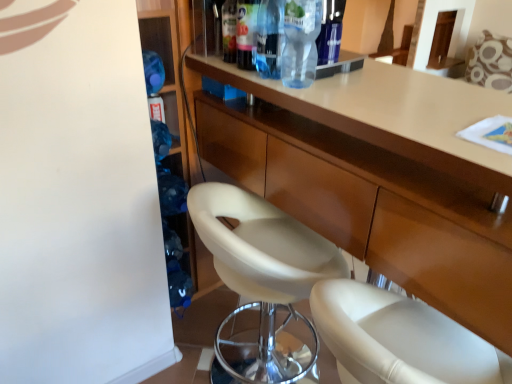
Question: Considering the positions of matte wood cabinet at center and transparent plastic bottle at upper center, which ranks as the 2th bottle in left-to-right order, in the image, is matte wood cabinet at center wider or thinner than transparent plastic bottle at upper center, which ranks as the 2th bottle in left-to-right order,?

Choices:
 (A) wide
 (B) thin

Answer: (A)

Question: Is point (409, 173) positioned closer to the camera than point (256, 59)?

Choices:
 (A) farther
 (B) closer

Answer: (B)

Question: Which is farther from the transparent plastic bottle at upper center, the first bottle in the right-to-left sequence?

Choices:
 (A) transparent plastic bottle at upper center, positioned as the 2th bottle in right-to-left order
 (B) translucent plastic bottle at upper center, the fourth bottle in the right-to-left sequence
 (C) transparent plastic bottle at upper center, which ranks as the 2th bottle in left-to-right order
 (D) matte wood cabinet at center
 (E) white leather chair at center

Answer: (E)

Question: Estimate the real-world distances between objects in this image. Which object is closer to the transparent plastic bottle at upper center, which is counted as the third bottle, starting from the right?

Choices:
 (A) matte wood cabinet at center
 (B) transparent plastic bottle at upper center, the 4th bottle from the left
 (C) white leather chair at center
 (D) translucent plastic bottle at upper center, which ranks as the 1th bottle in left-to-right order
 (E) transparent plastic bottle at upper center, positioned as the 2th bottle in right-to-left order

Answer: (B)